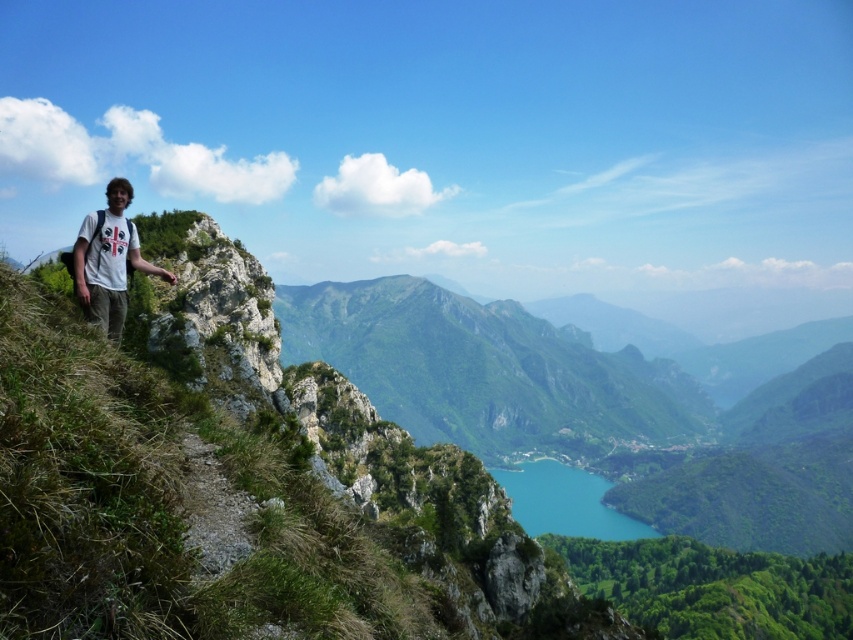
You are standing at the starting point of the rocky path on the left side of the turquoise glassy lake at center. If you want to reach the lake, which direction should you walk relative to the path?

The turquoise glassy lake at center is located at point (566, 500) in 2D coordinates, so you should walk towards the center of the image to reach it.

You are a hiker planning to reach the turquoise glassy lake at center from your current position at the white cotton shirt at upper left. Based on the distance provided, do you think you can walk there in 10 minutes if your average walking speed is 3 miles per hour?

The distance between the turquoise glassy lake at center and the white cotton shirt at upper left is 715.00 feet. Converting 3 miles per hour to feet per minute gives approximately 264 feet per minute. Multiplying 264 by 10 minutes equals 2,640 feet. Since 715 feet is less than 2,640 feet, yes, you can walk there in 10 minutes at that speed.

You are a hiker standing on the rugged, rocky path in the foreground of the mountainous landscape. You see a point marked at coordinates (566, 500). What natural feature does this point most likely represent?

The point at (566, 500) most likely represents the turquoise glassy lake at center, as it is specified in the Objects Description that this point corresponds to the lake.